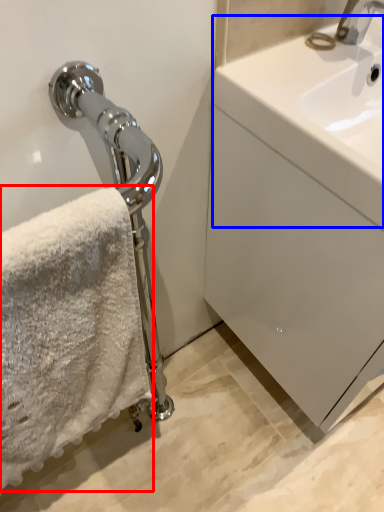
Question: Among these objects, which one is farthest to the camera, towel (highlighted by a red box) or counter top (highlighted by a blue box)?

Choices:
 (A) towel
 (B) counter top

Answer: (B)